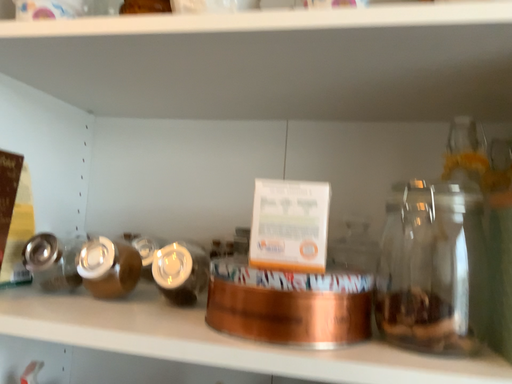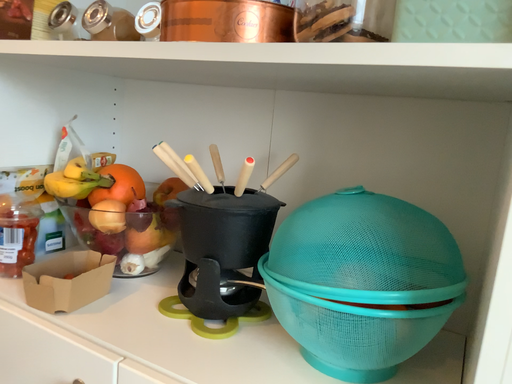
Question: Which way did the camera rotate in the video?

Choices:
 (A) rotated downward
 (B) rotated upward

Answer: (A)